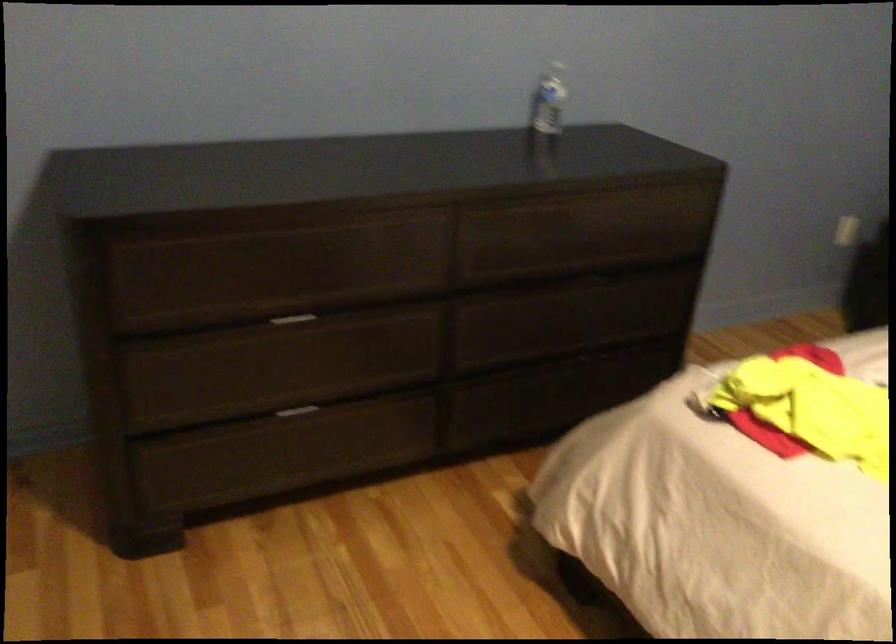
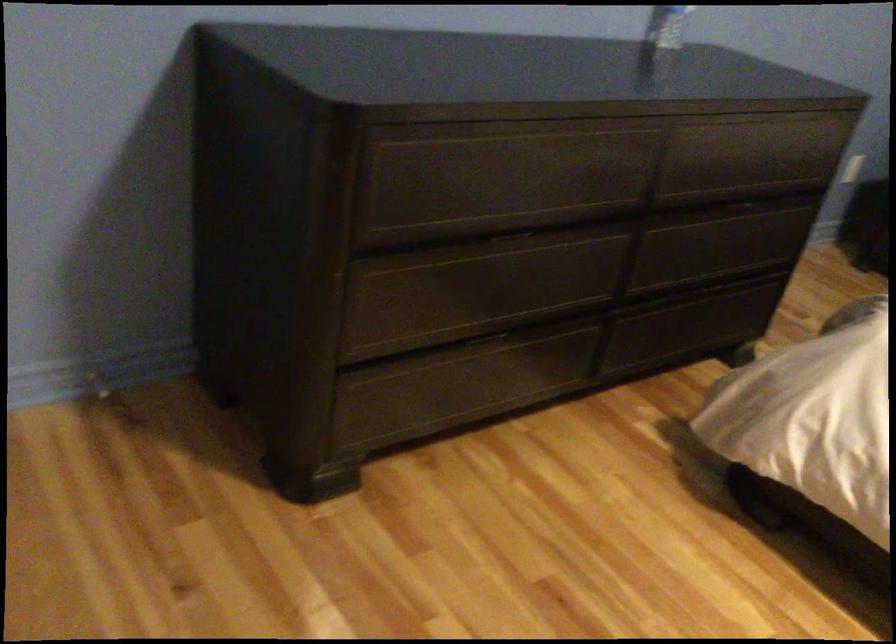
Question: Which direction would the cameraman need to move to produce the second image? Reply with the corresponding letter.

Choices:
 (A) Left
 (B) Right
 (C) Forward
 (D) Backward

Answer: (A)